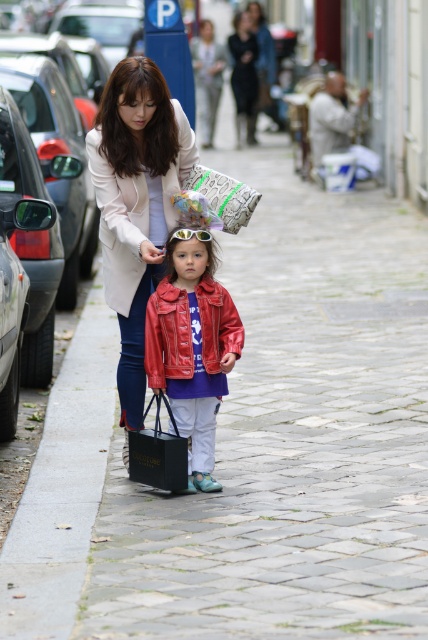
Who is more distant from viewer, (124, 371) or (225, 189)?

The point (225, 189) is behind.

Which of these two, matte white coat at center or patterned fabric bag at center, stands shorter?

patterned fabric bag at center is shorter.

Does point (177, 144) come behind point (196, 177)?

That is False.

At what (x,y) coordinates should I click in order to perform the action: click on matte white coat at center. Please return your answer as a coordinate pair (x, y). The image size is (428, 640). Looking at the image, I should click on (136, 205).

Which is in front, point (133, 468) or point (216, 179)?

Point (133, 468) is more forward.

Which is in front, point (163, 484) or point (238, 212)?

Point (163, 484) is in front.

I want to click on black matte bag at center, so click(158, 452).

Who is positioned more to the right, gray concrete curb at lower left or shiny red jacket at center?

shiny red jacket at center

I want to click on gray concrete curb at lower left, so click(x=62, y=484).

Where is `gray concrete curb at lower left`? gray concrete curb at lower left is located at coordinates (62, 484).